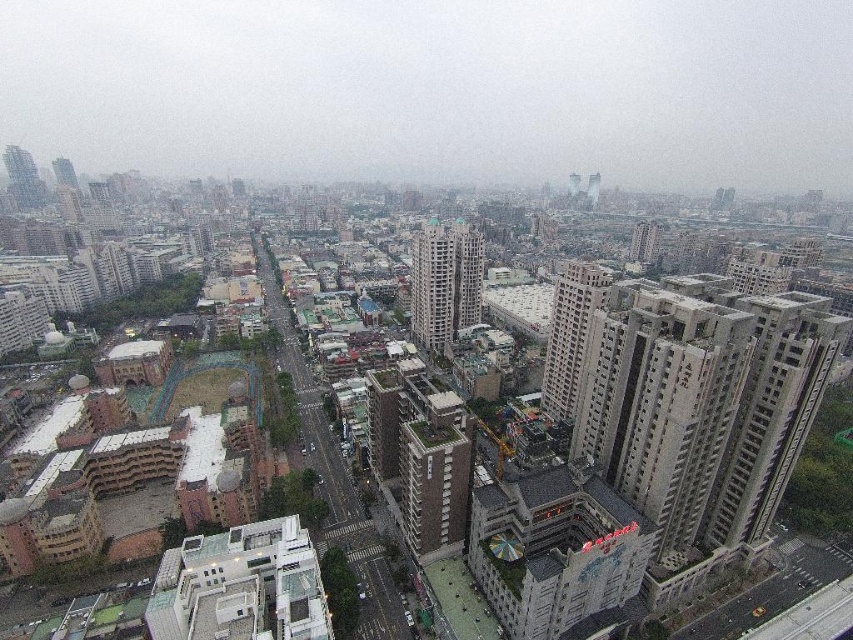
Question: Which object appears closest to the camera in this image?

Choices:
 (A) gray concrete building at right
 (B) beige concrete building at center
 (C) gray concrete building at center-right

Answer: (A)

Question: Which of the following is the closest to the observer?

Choices:
 (A) (541, 410)
 (B) (416, 467)
 (C) (722, 536)
 (D) (469, 292)

Answer: (B)

Question: Can you confirm if brown brick building at center is positioned to the right of gray concrete building at center-right?

Choices:
 (A) yes
 (B) no

Answer: (B)

Question: Which point is farther to the camera?

Choices:
 (A) gray concrete building at right
 (B) brown brick building at center
 (C) gray concrete building at center-right
 (D) beige concrete building at center

Answer: (D)

Question: Is brown brick building at center below beige concrete building at center?

Choices:
 (A) no
 (B) yes

Answer: (B)

Question: Where is brown brick building at center located in relation to beige concrete building at center in the image?

Choices:
 (A) right
 (B) left

Answer: (B)